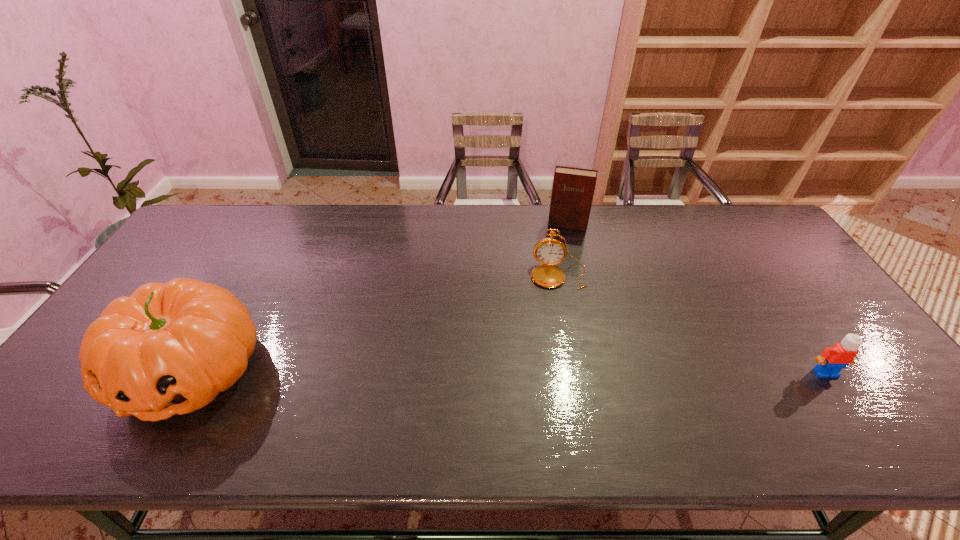
In order to click on free space between the diary and the rightmost object in this screenshot , I will do `click(697, 299)`.

Find the location of `object that is the closest to the leftmost object`. object that is the closest to the leftmost object is located at coordinates (549, 251).

Point out which object is positioned as the third nearest to the Lego. Please provide its 2D coordinates. Your answer should be formatted as a tuple, i.e. [(x, y)], where the tuple contains the x and y coordinates of a point satisfying the conditions above.

[(170, 348)]